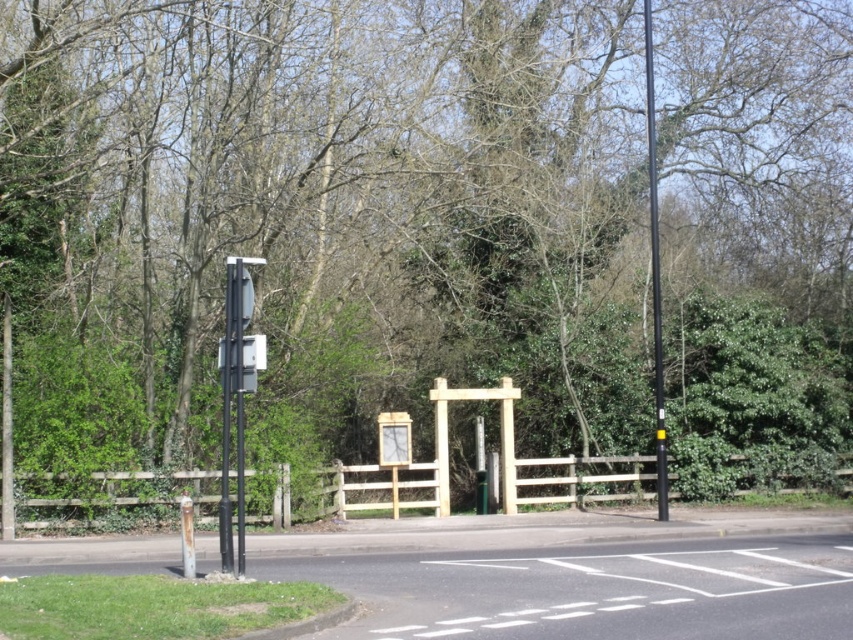
You are a delivery driver approaching the intersection and need to locate the metallic street sign at left. Based on the scene description, where should you look relative to the gate or entrance in the center?

The metallic street sign at left is located at point (236, 396) in 2D coordinates, which would be to the left side of the gate or entrance in the center.

You are a delivery driver approaching the intersection and need to locate the tallest object between the metallic street sign at left and the black smooth pole at right. Which one should you look for?

The black smooth pole at right is taller than the metallic street sign at left, so you should look for the black smooth pole at right as the tallest object.